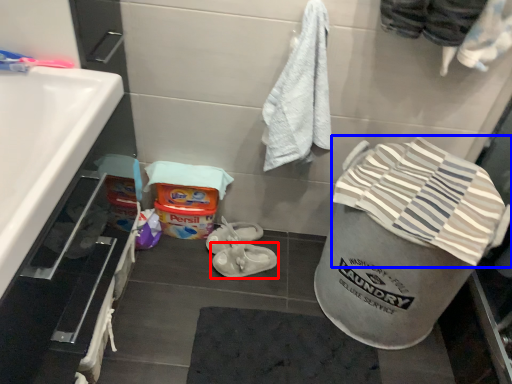
Question: Which object appears closest to the camera in this image, footwear (highlighted by a red box) or beach towel (highlighted by a blue box)?

Choices:
 (A) footwear
 (B) beach towel

Answer: (B)